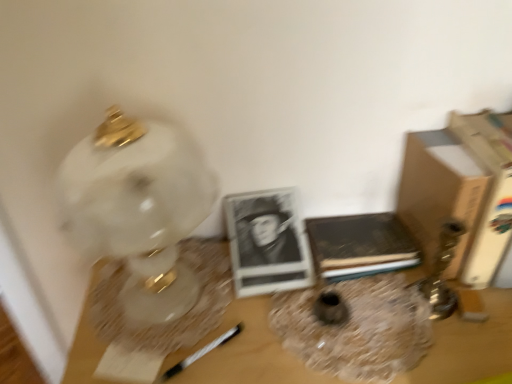
Question: Is matte glass vase at center, which ranks as the second vase in right-to-left order, positioned far away from wooden table at center?

Choices:
 (A) no
 (B) yes

Answer: (A)

Question: Is matte glass vase at center, which ranks as the second vase in right-to-left order, taller than wooden table at center?

Choices:
 (A) no
 (B) yes

Answer: (A)

Question: Considering the relative sizes of matte glass vase at center, which ranks as the second vase in right-to-left order, and wooden table at center in the image provided, is matte glass vase at center, which ranks as the second vase in right-to-left order, shorter than wooden table at center?

Choices:
 (A) no
 (B) yes

Answer: (B)

Question: Does matte glass vase at center, which ranks as the second vase in right-to-left order, come behind wooden table at center?

Choices:
 (A) yes
 (B) no

Answer: (A)

Question: Does matte glass vase at center, which ranks as the second vase in right-to-left order, appear on the right side of wooden table at center?

Choices:
 (A) yes
 (B) no

Answer: (B)

Question: Visually, is wooden table at center positioned to the left or to the right of white marble lamp at left?

Choices:
 (A) right
 (B) left

Answer: (A)

Question: From a real-world perspective, is wooden table at center physically located above or below white marble lamp at left?

Choices:
 (A) below
 (B) above

Answer: (A)

Question: Looking at the image, does wooden table at center seem bigger or smaller compared to white marble lamp at left?

Choices:
 (A) big
 (B) small

Answer: (A)

Question: Is wooden table at center taller or shorter than white marble lamp at left?

Choices:
 (A) tall
 (B) short

Answer: (A)

Question: Relative to wooden table at center, is translucent glass vase at center, which is counted as the first vase, starting from the right, in front or behind?

Choices:
 (A) front
 (B) behind

Answer: (B)

Question: Does point (387, 279) appear closer or farther from the camera than point (441, 324)?

Choices:
 (A) farther
 (B) closer

Answer: (A)

Question: From a real-world perspective, is translucent glass vase at center, which is counted as the first vase, starting from the right, physically located above or below wooden table at center?

Choices:
 (A) above
 (B) below

Answer: (A)

Question: Considering the positions of translucent glass vase at center, which is counted as the first vase, starting from the right, and wooden table at center in the image, is translucent glass vase at center, which is counted as the first vase, starting from the right, taller or shorter than wooden table at center?

Choices:
 (A) short
 (B) tall

Answer: (A)

Question: Considering the relative positions of wooden table at center and brown cardboard book at right, which is the 1th paperback book from right to left, in the image provided, is wooden table at center to the left or to the right of brown cardboard book at right, which is the 1th paperback book from right to left,?

Choices:
 (A) left
 (B) right

Answer: (A)

Question: Is wooden table at center spatially inside brown cardboard book at right, the 2th paperback book from the left, or outside of it?

Choices:
 (A) inside
 (B) outside

Answer: (B)